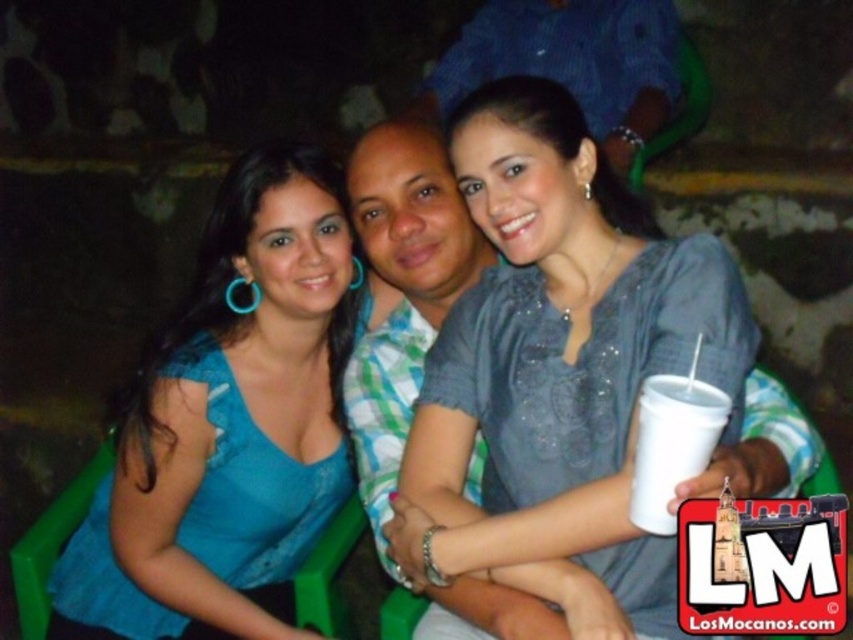
Question: Which point is closer to the camera?

Choices:
 (A) (561, 64)
 (B) (558, 438)
 (C) (672, 378)

Answer: (C)

Question: Based on their relative distances, which object is nearer to the white styrofoam cup at lower right?

Choices:
 (A) blue plaid shirt at center
 (B) blue fabric top at center
 (C) gray matte shirt at center

Answer: (C)

Question: Can you confirm if blue plaid shirt at center is smaller than white styrofoam cup at lower right?

Choices:
 (A) no
 (B) yes

Answer: (A)

Question: Is blue plaid shirt at center smaller than white styrofoam cup at lower right?

Choices:
 (A) yes
 (B) no

Answer: (B)

Question: Which point is farther from the camera taking this photo?

Choices:
 (A) (521, 468)
 (B) (206, 246)

Answer: (B)

Question: Does gray matte shirt at center appear under blue plaid shirt at center?

Choices:
 (A) no
 (B) yes

Answer: (B)